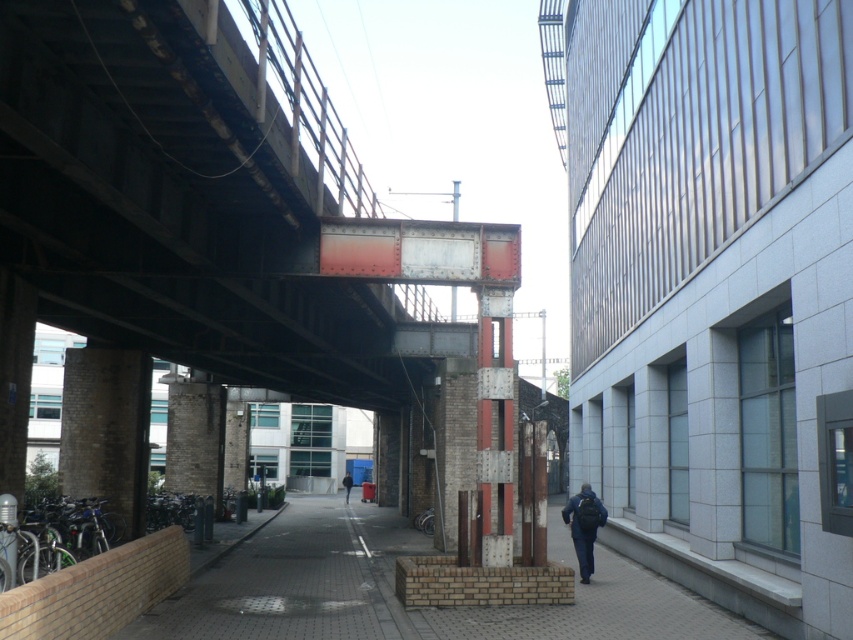
Question: Is brick pavement at lower center below smooth concrete pavement at center?

Choices:
 (A) yes
 (B) no

Answer: (B)

Question: From the image, what is the correct spatial relationship of rusty metal bridge at center in relation to brown stone pillar at center?

Choices:
 (A) below
 (B) above

Answer: (B)

Question: From the image, what is the correct spatial relationship of rusty metal bridge at center in relation to dark blue jacket at center?

Choices:
 (A) left
 (B) right

Answer: (B)

Question: Which point is closer to the camera?

Choices:
 (A) click(x=346, y=497)
 (B) click(x=605, y=620)
 (C) click(x=387, y=593)
 (D) click(x=97, y=92)

Answer: (D)

Question: Among these points, which one is farthest from the camera?

Choices:
 (A) (291, 624)
 (B) (352, 483)

Answer: (B)

Question: Which is nearer to the dark blue jeans at center?

Choices:
 (A) dark blue jacket at center
 (B) brick pavement at lower center
 (C) smooth concrete pavement at center
 (D) brown stone pillar at center

Answer: (B)